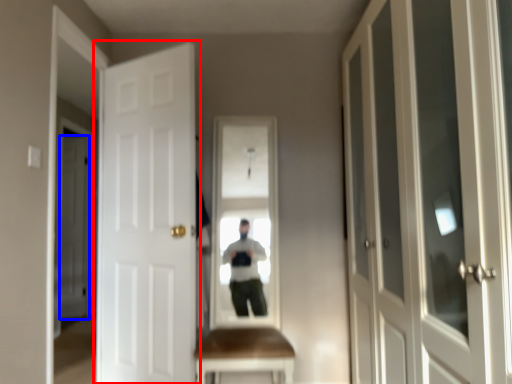
Question: Among these objects, which one is farthest to the camera, door (highlighted by a red box) or door (highlighted by a blue box)?

Choices:
 (A) door
 (B) door

Answer: (B)